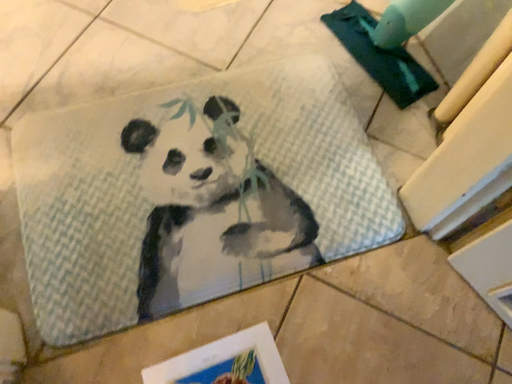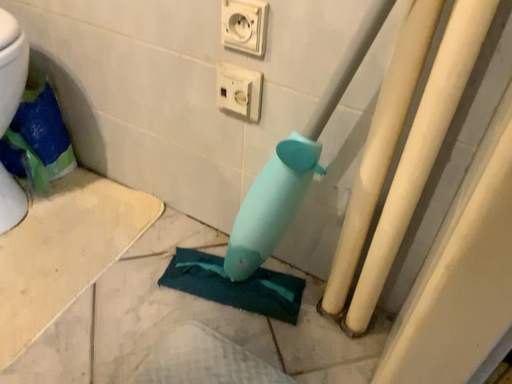
Question: Which way did the camera rotate in the video?

Choices:
 (A) rotated left
 (B) rotated right

Answer: (B)